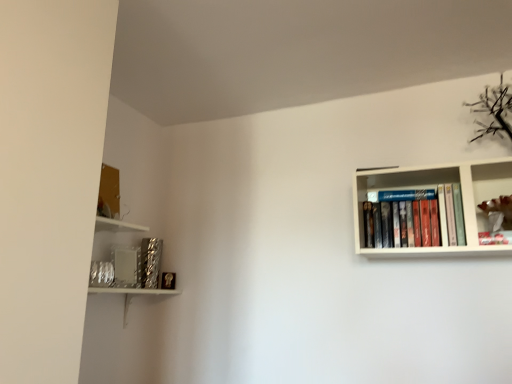
Question: Is hardcover books at upper right positioned with its back to metallic silver frame at upper right?

Choices:
 (A) yes
 (B) no

Answer: (B)

Question: Considering the relative sizes of hardcover books at upper right and metallic silver frame at upper right in the image provided, is hardcover books at upper right bigger than metallic silver frame at upper right?

Choices:
 (A) yes
 (B) no

Answer: (A)

Question: Is hardcover books at upper right not inside metallic silver frame at upper right?

Choices:
 (A) yes
 (B) no

Answer: (A)

Question: From the image's perspective, is hardcover books at upper right located above metallic silver frame at upper right?

Choices:
 (A) yes
 (B) no

Answer: (B)

Question: Is hardcover books at upper right at the right side of metallic silver frame at upper right?

Choices:
 (A) no
 (B) yes

Answer: (A)

Question: Is metallic silver frame at upper right inside the boundaries of hardcover books at upper right, or outside?

Choices:
 (A) inside
 (B) outside

Answer: (B)

Question: From the image's perspective, is metallic silver frame at upper right located above or below hardcover books at upper right?

Choices:
 (A) above
 (B) below

Answer: (A)

Question: From a real-world perspective, relative to hardcover books at upper right, is metallic silver frame at upper right vertically above or below?

Choices:
 (A) above
 (B) below

Answer: (B)

Question: In terms of size, does metallic silver frame at upper right appear bigger or smaller than hardcover books at upper right?

Choices:
 (A) big
 (B) small

Answer: (B)

Question: From the image's perspective, relative to metallic silver frame at upper right, is hardcover books at upper right above or below?

Choices:
 (A) below
 (B) above

Answer: (A)

Question: Is hardcover books at upper right bigger or smaller than metallic silver frame at upper right?

Choices:
 (A) small
 (B) big

Answer: (B)

Question: Looking at their shapes, would you say hardcover books at upper right is wider or thinner than metallic silver frame at upper right?

Choices:
 (A) wide
 (B) thin

Answer: (B)

Question: Which is correct: hardcover books at upper right is inside metallic silver frame at upper right, or outside of it?

Choices:
 (A) inside
 (B) outside

Answer: (B)

Question: From the image's perspective, is metallic textured book at lower left above or below hardcover books at upper right?

Choices:
 (A) below
 (B) above

Answer: (A)

Question: Visually, is metallic textured book at lower left positioned to the left or to the right of hardcover books at upper right?

Choices:
 (A) right
 (B) left

Answer: (B)